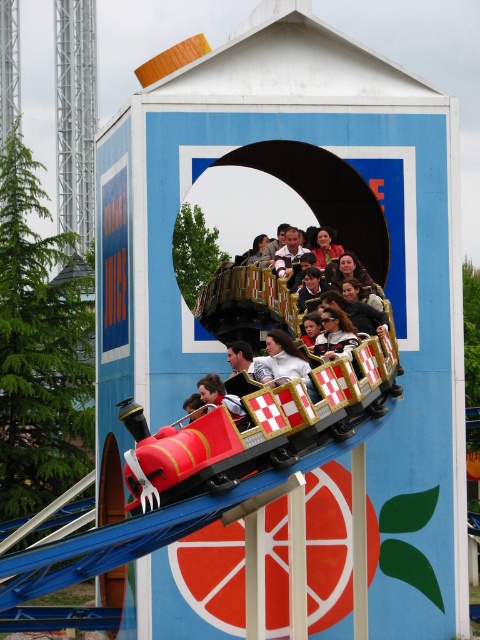
Which is above, metallic red roller coaster at center or matte black roller coaster car at center?

matte black roller coaster car at center is above.

Does metallic red roller coaster at center have a greater height compared to matte black roller coaster car at center?

Incorrect, metallic red roller coaster at center's height is not larger of matte black roller coaster car at center's.

Where is `metallic red roller coaster at center`? This screenshot has width=480, height=640. metallic red roller coaster at center is located at coordinates (215, 452).

Image resolution: width=480 pixels, height=640 pixels. In order to click on metallic red roller coaster at center in this screenshot , I will do `click(215, 452)`.

Does metallic red roller coaster at center have a greater width compared to matte black sunglasses at center?

Correct, the width of metallic red roller coaster at center exceeds that of matte black sunglasses at center.

Is point (164, 500) farther from camera compared to point (338, 323)?

That is False.

Between point (200, 460) and point (337, 312), which one is positioned in front?

Point (200, 460) is more forward.

Locate an element on the screen. Image resolution: width=480 pixels, height=640 pixels. metallic red roller coaster at center is located at coordinates (215, 452).

Consider the image. Can you confirm if matte black roller coaster car at center is wider than matte black sunglasses at center?

Indeed, matte black roller coaster car at center has a greater width compared to matte black sunglasses at center.

Is matte black roller coaster car at center behind matte black sunglasses at center?

That is True.

This screenshot has width=480, height=640. Describe the element at coordinates (244, 305) in the screenshot. I see `matte black roller coaster car at center` at that location.

Where is `matte black roller coaster car at center`? The height and width of the screenshot is (640, 480). matte black roller coaster car at center is located at coordinates (244, 305).